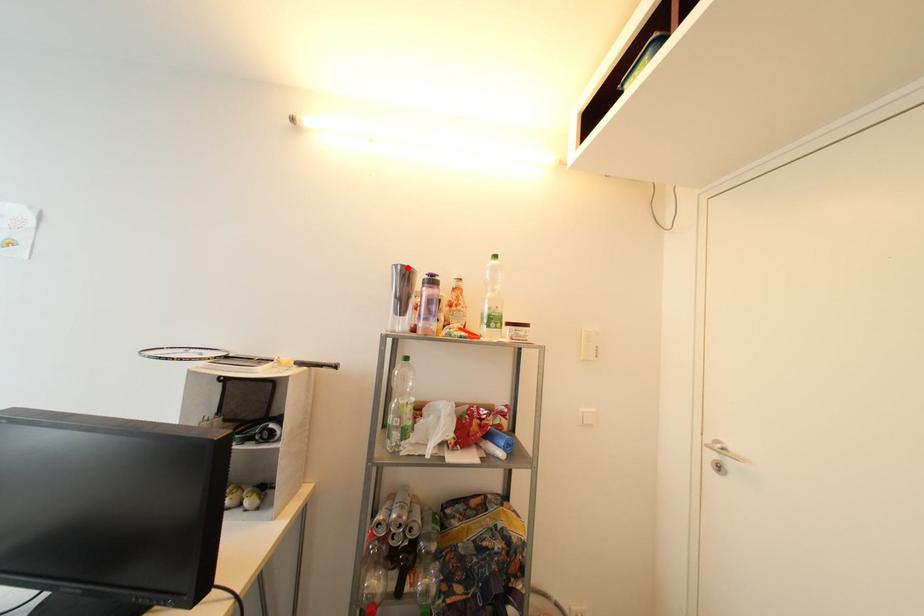
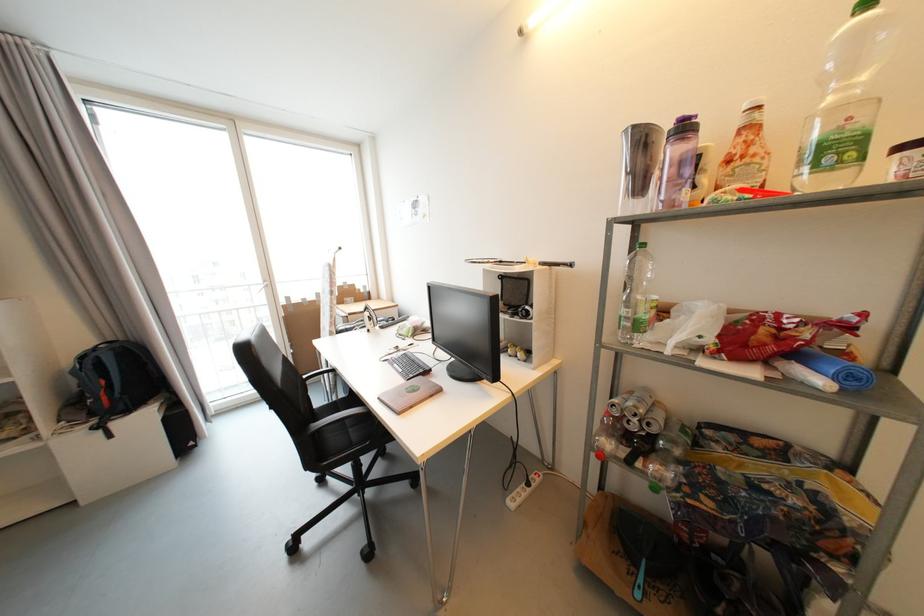
Locate, in the second image, the point that corresponds to the highlighted location in the first image.

(639, 129)